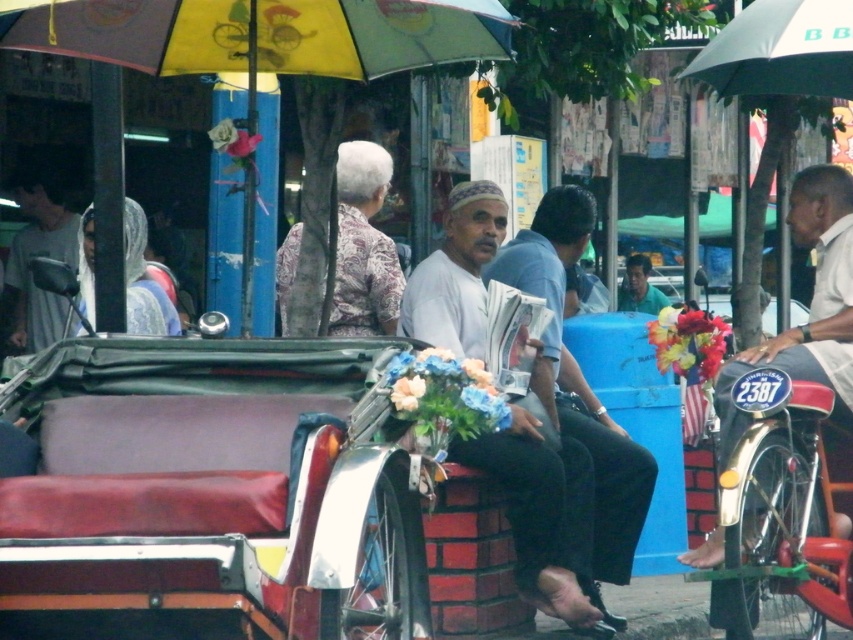
Between yellow fabric umbrella at upper center and green fabric umbrella at upper right, which one appears on the right side from the viewer's perspective?

From the viewer's perspective, green fabric umbrella at upper right appears more on the right side.

The width and height of the screenshot is (853, 640). I want to click on yellow fabric umbrella at upper center, so click(262, 35).

The height and width of the screenshot is (640, 853). In order to click on yellow fabric umbrella at upper center in this screenshot , I will do `click(262, 35)`.

Is metallic silver coach at right wider than matte gray shirt at left?

No.

Can you confirm if metallic silver coach at right is bigger than matte gray shirt at left?

Incorrect, metallic silver coach at right is not larger than matte gray shirt at left.

Is point (833, 280) farther from camera compared to point (24, 228)?

That is False.

Identify the location of metallic silver coach at right. (810, 304).

Which of these two, green fabric umbrella at upper right or green fabric shirt at center, stands shorter?

green fabric umbrella at upper right is shorter.

Between green fabric umbrella at upper right and green fabric shirt at center, which one appears on the left side from the viewer's perspective?

Positioned to the left is green fabric umbrella at upper right.

Does point (779, 83) lie in front of point (624, 280)?

Yes.

Find the location of a particular element. green fabric umbrella at upper right is located at coordinates (781, 51).